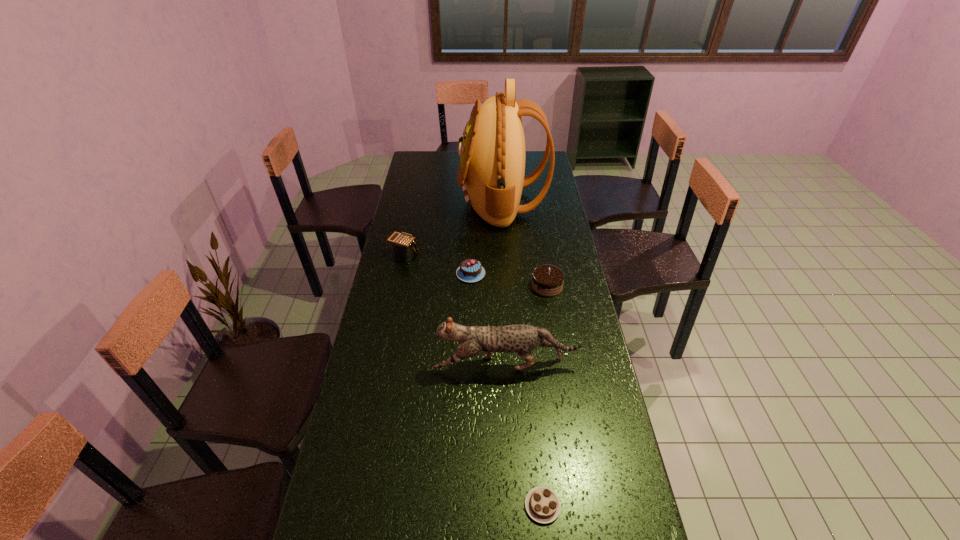
This screenshot has width=960, height=540. I want to click on object positioned at the left edge, so click(x=403, y=245).

Image resolution: width=960 pixels, height=540 pixels. Find the location of `backpack located in the right edge section of the desktop`. backpack located in the right edge section of the desktop is located at coordinates (491, 171).

Identify the location of cat that is at the right edge. This screenshot has width=960, height=540. (522, 339).

You are a GUI agent. You are given a task and a screenshot of the screen. Output one action in this format:
    pyautogui.click(x=<x>, y=<y>)
    Task: Click on the chocolate cake present at the right edge
    The height and width of the screenshot is (540, 960).
    Given the screenshot: What is the action you would take?
    pyautogui.click(x=547, y=280)

Where is `vacant space at the far edge of the desktop`? This screenshot has height=540, width=960. vacant space at the far edge of the desktop is located at coordinates (444, 157).

Find the location of a particular element. vacant space at the left edge is located at coordinates (432, 207).

This screenshot has width=960, height=540. In the image, there is a desktop. In order to click on vacant area at the right edge in this screenshot , I will do `click(544, 213)`.

In the image, there is a desktop. Where is `vacant space at the far left corner`? vacant space at the far left corner is located at coordinates (417, 169).

You are a GUI agent. You are given a task and a screenshot of the screen. Output one action in this format:
    pyautogui.click(x=<x>, y=<y>)
    Task: Click on the free space between the leftmost object and the second tallest chocolate cake
    This screenshot has width=960, height=540.
    Given the screenshot: What is the action you would take?
    pyautogui.click(x=438, y=264)

Where is `unoccupied area between the fifth farthest object and the farthest object`? The width and height of the screenshot is (960, 540). unoccupied area between the fifth farthest object and the farthest object is located at coordinates (504, 284).